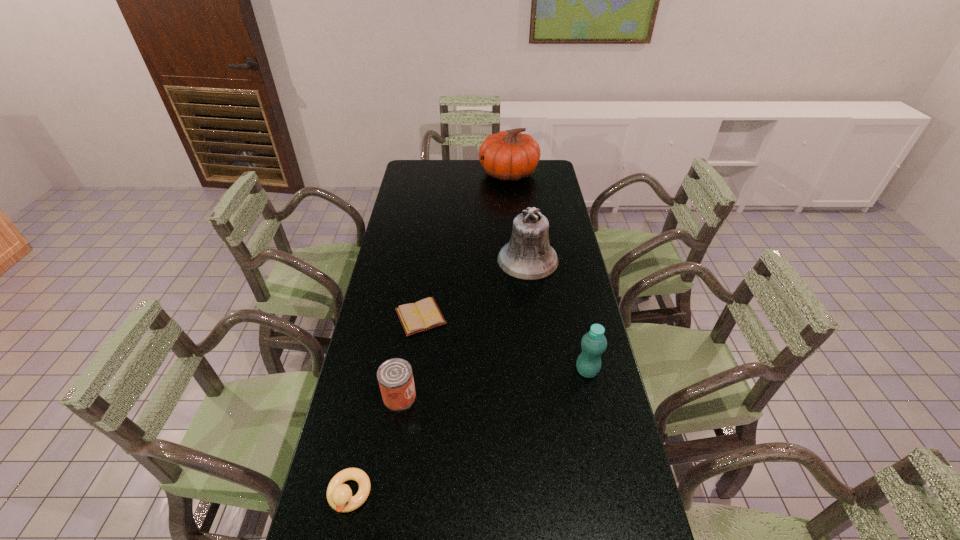
Locate an element on the screen. Image resolution: width=960 pixels, height=540 pixels. object that ranks as the fifth closest to the shortest object is located at coordinates 509,156.

This screenshot has width=960, height=540. I want to click on object that stands as the fourth closest to the can, so click(x=528, y=255).

You are a GUI agent. You are given a task and a screenshot of the screen. Output one action in this format:
    pyautogui.click(x=<x>, y=<y>)
    Task: Click on the blank area in the image that satisfies the following two spatial constraints: 1. on the back side of the bell; 2. on the left side of the shortest object
    The height and width of the screenshot is (540, 960).
    Given the screenshot: What is the action you would take?
    pyautogui.click(x=428, y=260)

The width and height of the screenshot is (960, 540). Find the location of `vacant space that satisfies the following two spatial constraints: 1. on the back side of the fourth tallest object; 2. on the left side of the diary`. vacant space that satisfies the following two spatial constraints: 1. on the back side of the fourth tallest object; 2. on the left side of the diary is located at coordinates (412, 317).

At what (x,y) coordinates should I click in order to perform the action: click on free point that satisfies the following two spatial constraints: 1. on the face of the pumpkin; 2. on the right side of the bell. Please return your answer as a coordinate pair (x, y). Looking at the image, I should click on (517, 260).

Find the location of a particular element. vacant position in the image that satisfies the following two spatial constraints: 1. at the front cap of the third nearest object; 2. on the front side of the fourth tallest object is located at coordinates (592, 396).

Locate an element on the screen. free space that satisfies the following two spatial constraints: 1. on the face of the pumpkin; 2. at the beak of the duckling is located at coordinates (540, 495).